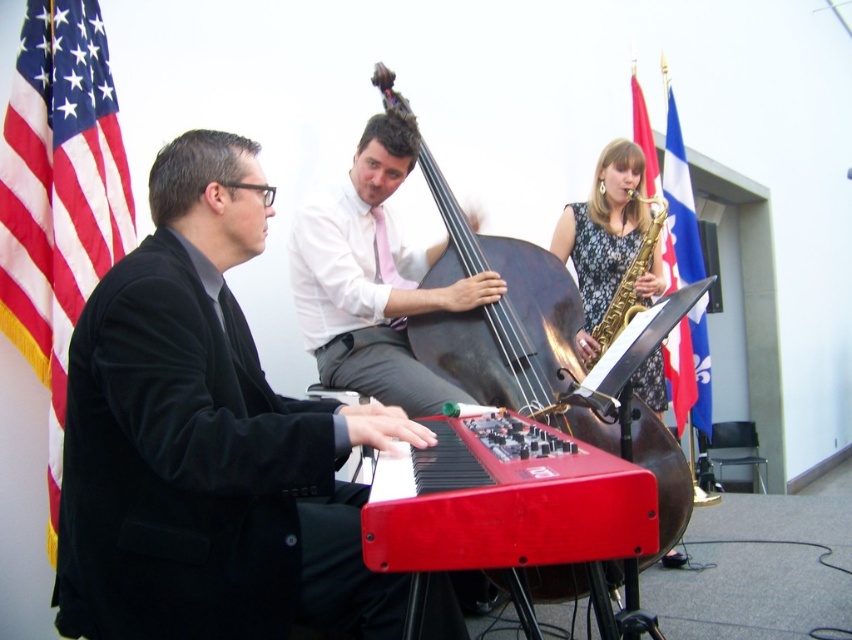
Where is the pink silk tie at center located in the image?

The pink silk tie at center is located at point (372, 276).

You are a stagehand needing to move a 2.5 meter ladder from the pink silk tie at center to the blue fabric flag at upper right. Can you safely move it without tilting the ladder?

The distance between the pink silk tie at center and the blue fabric flag at upper right is 2.64 meters. Since the ladder is 2.5 meters long, it can be moved horizontally between them without tilting.

You are a photographer trying to capture a closeup of the pink silk tie at center and the blue fabric flag at upper right in the image. Which object is wider?

The pink silk tie at center is wider than the blue fabric flag at upper right.